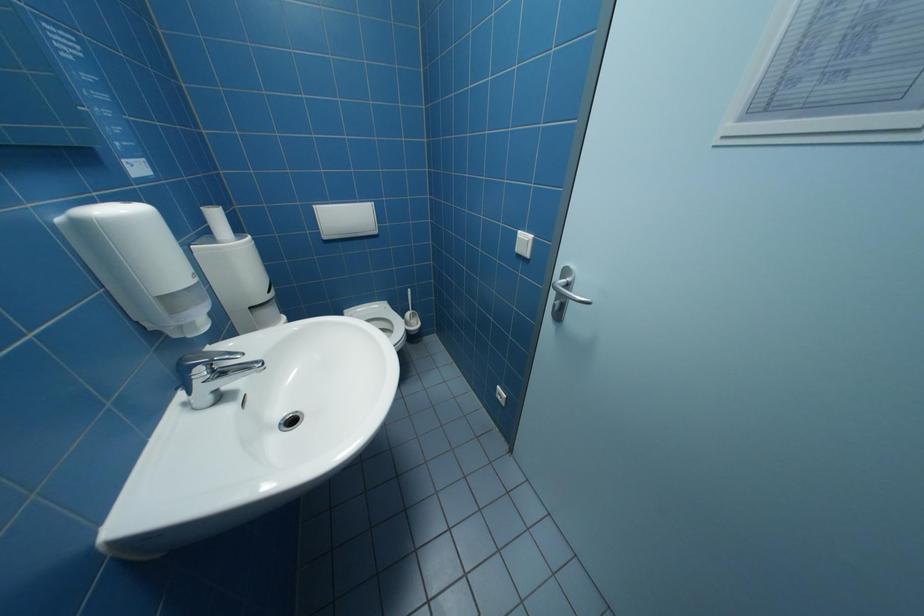
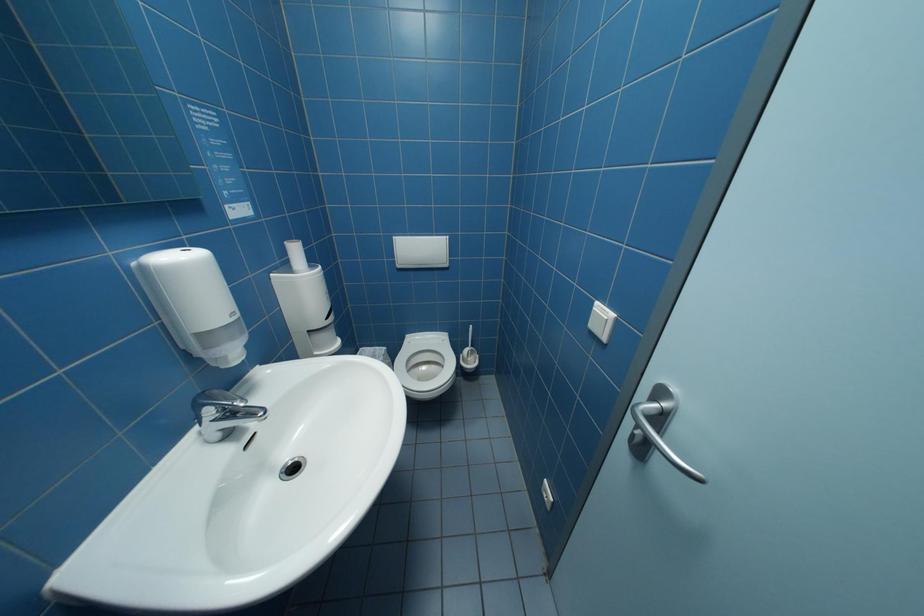
Question: The camera is either moving clockwise (left) or counter-clockwise (right) around the object. The first image is from the beginning of the video and the second image is from the end. Is the camera moving left or right when shooting the video?

Choices:
 (A) Left
 (B) Right

Answer: (B)